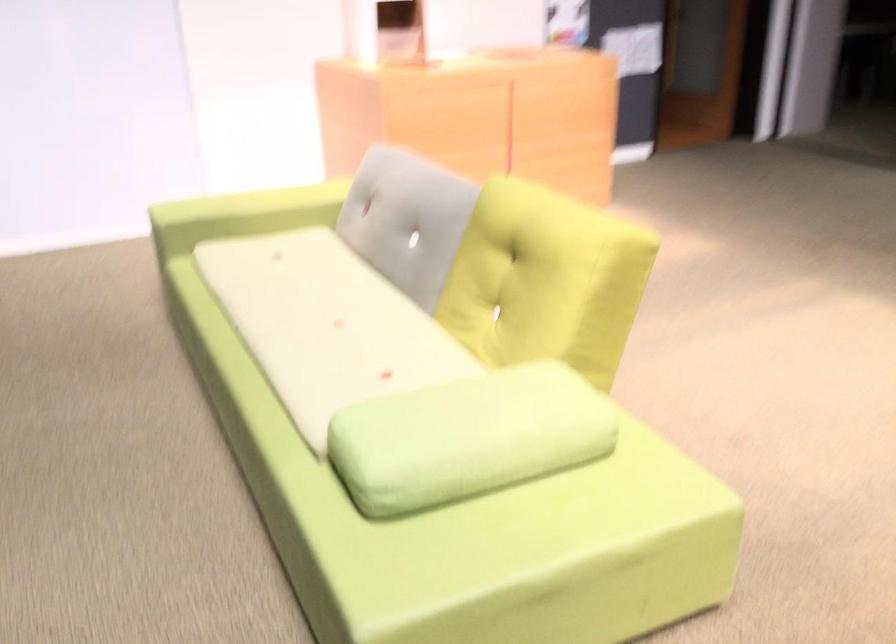
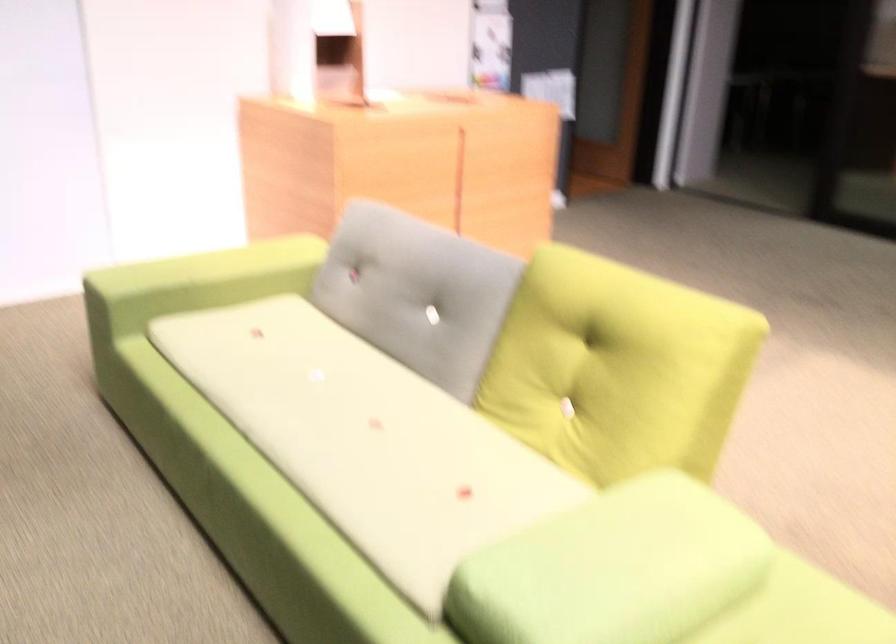
In the second image, find the point that corresponds to (528,272) in the first image.

(616, 368)